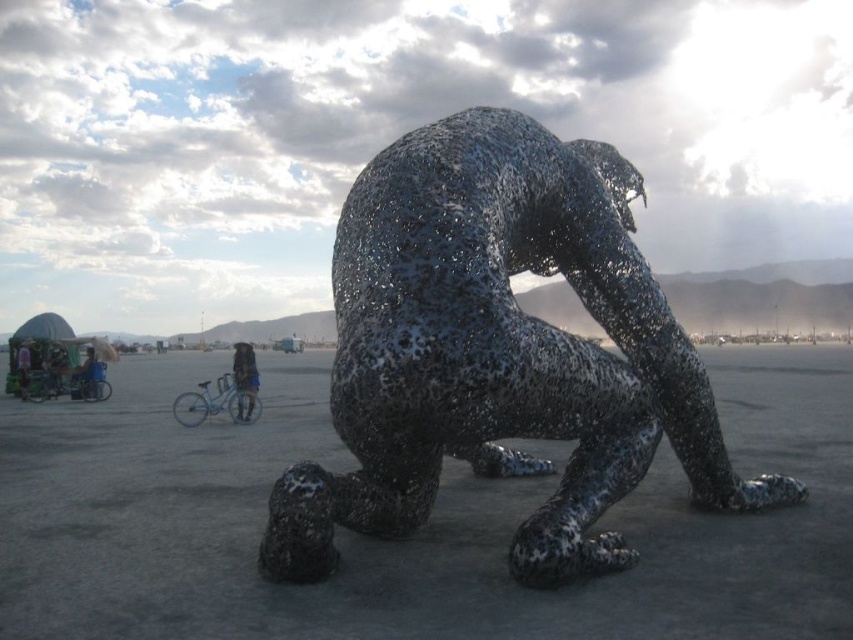
Is point (589, 304) positioned behind point (233, 358)?

No, it is in front of (233, 358).

Find the location of a particular element. metallic wire sculpture at center is located at coordinates click(x=498, y=349).

In order to click on metallic wire sculpture at center in this screenshot , I will do `click(498, 349)`.

Does denim jacket at lower center have a greater width compared to denim jacket at lower left?

Incorrect, denim jacket at lower center's width does not surpass denim jacket at lower left's.

Is denim jacket at lower center taller than denim jacket at lower left?

No, denim jacket at lower center is not taller than denim jacket at lower left.

Is point (248, 372) positioned before point (20, 374)?

Yes, point (248, 372) is closer to viewer.

You are a GUI agent. You are given a task and a screenshot of the screen. Output one action in this format:
    pyautogui.click(x=<x>, y=<y>)
    Task: Click on the denim jacket at lower center
    Image resolution: width=853 pixels, height=640 pixels.
    Given the screenshot: What is the action you would take?
    pyautogui.click(x=245, y=378)

Is point (376, 340) positioned before point (16, 355)?

Yes, point (376, 340) is closer to viewer.

How far apart are metallic wire sculpture at center and denim jacket at lower left?

metallic wire sculpture at center is 11.50 meters from denim jacket at lower left.

This screenshot has height=640, width=853. I want to click on metallic wire sculpture at center, so click(498, 349).